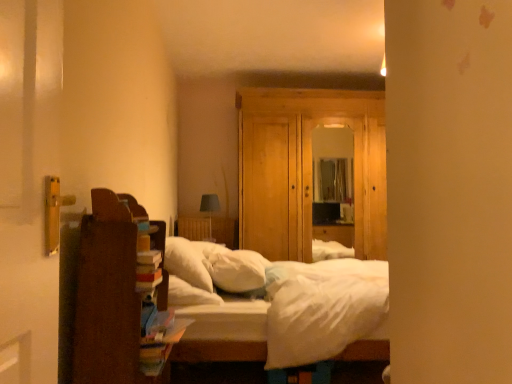
Question: Can you confirm if white soft pillow at center, which is the first pillow from right to left, is thinner than brown wooden bookshelf at left?

Choices:
 (A) yes
 (B) no

Answer: (B)

Question: From the image's perspective, is white soft pillow at center, which is the first pillow from right to left, located above brown wooden bookshelf at left?

Choices:
 (A) yes
 (B) no

Answer: (B)

Question: From a real-world perspective, is white soft pillow at center, which is the 2th pillow from left to right, on brown wooden bookshelf at left?

Choices:
 (A) no
 (B) yes

Answer: (B)

Question: Considering the relative positions of white soft pillow at center, which is the 2th pillow from left to right, and brown wooden bookshelf at left in the image provided, is white soft pillow at center, which is the 2th pillow from left to right, to the right of brown wooden bookshelf at left from the viewer's perspective?

Choices:
 (A) no
 (B) yes

Answer: (B)

Question: Can you confirm if white soft pillow at center, which is the 2th pillow from left to right, is positioned to the left of brown wooden bookshelf at left?

Choices:
 (A) no
 (B) yes

Answer: (A)

Question: In the image, is white soft pillow at center, which is the 2th pillow from left to right, on the left side or the right side of wooden dresser at center?

Choices:
 (A) right
 (B) left

Answer: (B)

Question: Based on their sizes in the image, would you say white soft pillow at center, which is the 2th pillow from left to right, is bigger or smaller than wooden dresser at center?

Choices:
 (A) big
 (B) small

Answer: (B)

Question: Considering the positions of point (210, 264) and point (359, 200), is point (210, 264) closer or farther from the camera than point (359, 200)?

Choices:
 (A) closer
 (B) farther

Answer: (A)

Question: Is white soft pillow at center, which is the first pillow from right to left, taller or shorter than wooden dresser at center?

Choices:
 (A) short
 (B) tall

Answer: (A)

Question: Considering the positions of white soft pillow at center, which is the first pillow from right to left, and white soft pillow at center, the 1th pillow from the left, in the image, is white soft pillow at center, which is the first pillow from right to left, wider or thinner than white soft pillow at center, the 1th pillow from the left,?

Choices:
 (A) thin
 (B) wide

Answer: (B)

Question: Looking at the image, does white soft pillow at center, which is the 2th pillow from left to right, seem bigger or smaller compared to white soft pillow at center, the 1th pillow from the left?

Choices:
 (A) small
 (B) big

Answer: (A)

Question: From the image's perspective, relative to white soft pillow at center, the 1th pillow from the left, is white soft pillow at center, which is the first pillow from right to left, above or below?

Choices:
 (A) below
 (B) above

Answer: (A)

Question: From a real-world perspective, is white soft pillow at center, which is the first pillow from right to left, above or below white soft pillow at center, the 2th pillow viewed from the right?

Choices:
 (A) below
 (B) above

Answer: (A)

Question: Considering the positions of point (281, 193) and point (92, 218), is point (281, 193) closer or farther from the camera than point (92, 218)?

Choices:
 (A) closer
 (B) farther

Answer: (B)

Question: From a real-world perspective, is wooden dresser at center above or below brown wooden bookshelf at left?

Choices:
 (A) above
 (B) below

Answer: (A)